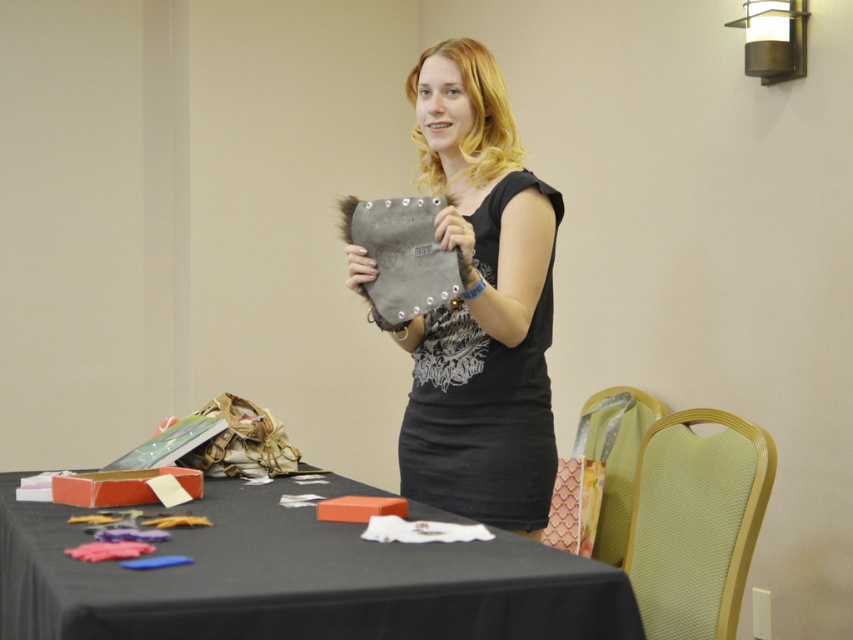
Does black fabric table at lower left have a greater width compared to matte gray pouch at center?

Yes.

Is black fabric table at lower left positioned in front of matte gray pouch at center?

Yes, it is.

Who is more distant from viewer, (x=596, y=602) or (x=415, y=349)?

Positioned behind is point (x=415, y=349).

Locate an element on the screen. black fabric table at lower left is located at coordinates (297, 579).